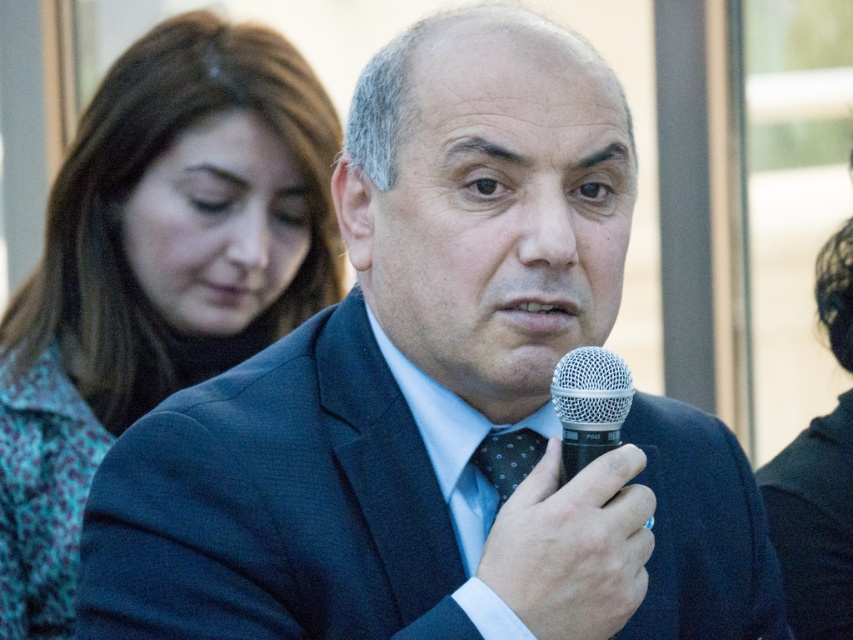
You are a photographer adjusting your camera settings. You notice the silver metallic microphone at center and the dark blue dotted tie at center in the frame. Given that the minimum focus distance for your lens is 6 inches, will both objects be in focus?

The silver metallic microphone at center is 6.59 inches from dark blue dotted tie at center. Since the distance between them is greater than the minimum focus distance of 6 inches, both objects can be in focus if the depth of field is sufficient. However, the exact focus depends on the aperture setting and camera position.

What are the coordinates of the matte floral shirt at left in the image?

The coordinates of the matte floral shirt at left are at point (x=155, y=273).

From the picture: You are a photographer at a conference. You need to capture a photo where the silver metallic microphone at center and the dark blue dotted tie at center are both visible. Based on their positions, which object is closer to the camera?

The silver metallic microphone at center is positioned over the dark blue dotted tie at center, meaning it is closer to the camera.